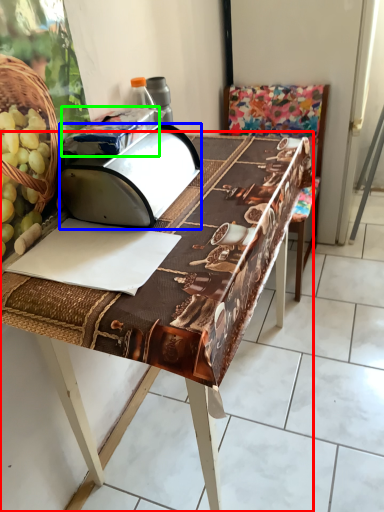
Question: Which object is positioned closest to table (highlighted by a red box)? Select from wide (highlighted by a blue box) and wrapping paper (highlighted by a green box).

Choices:
 (A) wide
 (B) wrapping paper

Answer: (A)